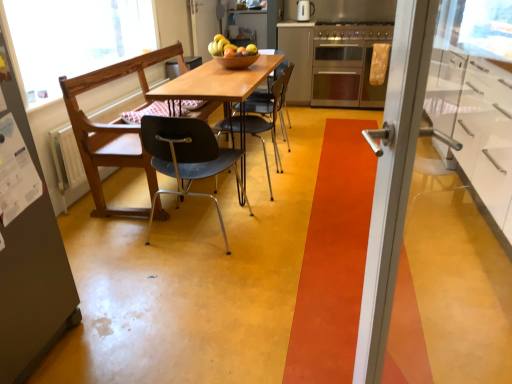
Question: Can you confirm if wooden chair at center, the 2th chair when ordered from front to back, is bigger than matte black chair at center, the first chair positioned from the front?

Choices:
 (A) no
 (B) yes

Answer: (B)

Question: Is wooden chair at center, the 2th chair when ordered from front to back, outside of matte black chair at center, positioned as the third chair in back-to-front order?

Choices:
 (A) no
 (B) yes

Answer: (B)

Question: From the image's perspective, does wooden chair at center, the 2th chair when ordered from front to back, appear lower than matte black chair at center, the first chair positioned from the front?

Choices:
 (A) no
 (B) yes

Answer: (A)

Question: Is wooden chair at center, the second chair in the back-to-front sequence, taller than matte black chair at center, the first chair positioned from the front?

Choices:
 (A) no
 (B) yes

Answer: (B)

Question: Is the depth of wooden chair at center, the second chair in the back-to-front sequence, greater than that of matte black chair at center, the first chair positioned from the front?

Choices:
 (A) yes
 (B) no

Answer: (A)

Question: From the image's perspective, is wooden chair at center, the 2th chair when ordered from front to back, above or below wooden table at center?

Choices:
 (A) below
 (B) above

Answer: (B)

Question: Is wooden chair at center, the 2th chair when ordered from front to back, to the left or to the right of wooden table at center in the image?

Choices:
 (A) right
 (B) left

Answer: (B)

Question: In terms of width, does wooden chair at center, the 2th chair when ordered from front to back, look wider or thinner when compared to wooden table at center?

Choices:
 (A) wide
 (B) thin

Answer: (B)

Question: Considering the positions of wooden chair at center, the 2th chair when ordered from front to back, and wooden table at center in the image, is wooden chair at center, the 2th chair when ordered from front to back, taller or shorter than wooden table at center?

Choices:
 (A) tall
 (B) short

Answer: (A)

Question: In the image, is matte black chair at center, the first chair positioned from the front, positioned in front of or behind satin silver cabinet at center, the second cabinetry positioned from the right?

Choices:
 (A) front
 (B) behind

Answer: (A)

Question: From a real-world perspective, relative to satin silver cabinet at center, acting as the 2th cabinetry starting from the bottom, is matte black chair at center, the first chair positioned from the front, vertically above or below?

Choices:
 (A) below
 (B) above

Answer: (A)

Question: Does point (223, 168) appear closer or farther from the camera than point (286, 54)?

Choices:
 (A) farther
 (B) closer

Answer: (B)

Question: Looking at the image, does matte black chair at center, the first chair positioned from the front, seem bigger or smaller compared to satin silver cabinet at center, the first cabinetry when ordered from left to right?

Choices:
 (A) small
 (B) big

Answer: (A)

Question: From a real-world perspective, is stainless steel oven at center positioned above or below matte black chair at center, the first chair positioned from the front?

Choices:
 (A) below
 (B) above

Answer: (B)

Question: Does point (353, 54) appear closer or farther from the camera than point (163, 163)?

Choices:
 (A) closer
 (B) farther

Answer: (B)